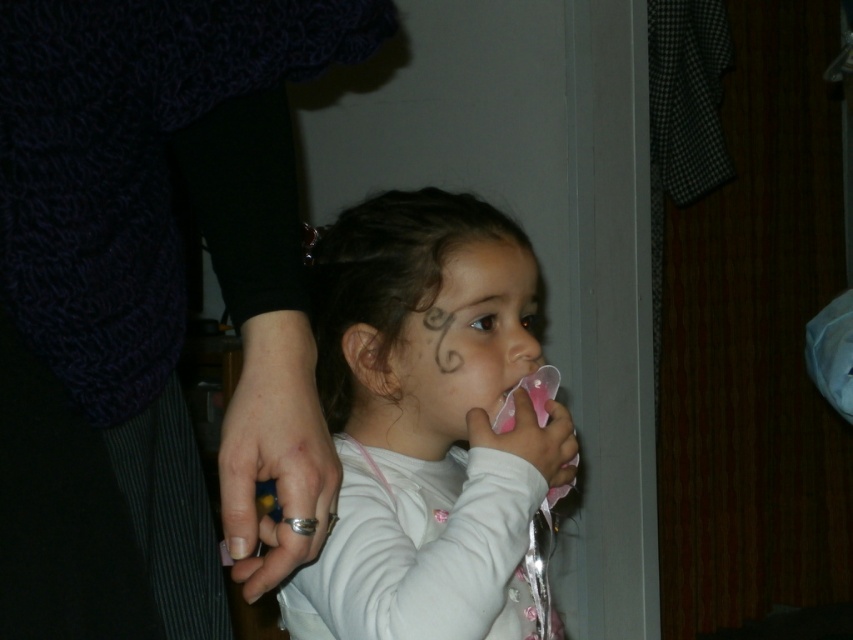
From the picture: Does knitted dark blue sweater at upper left appear under white matte pacifier at center?

No.

In the scene shown: Is knitted dark blue sweater at upper left smaller than white matte pacifier at center?

Correct, knitted dark blue sweater at upper left occupies less space than white matte pacifier at center.

Identify the location of knitted dark blue sweater at upper left. click(152, 305).

Who is positioned more to the right, pink rubber pacifier at center or matte white forehead at center?

matte white forehead at center

How distant is pink rubber pacifier at center from matte white forehead at center?

They are 2.22 inches apart.

Between point (462, 353) and point (490, 260), which one is positioned in front?

Point (462, 353) is in front.

Locate an element on the screen. Image resolution: width=853 pixels, height=640 pixels. pink rubber pacifier at center is located at coordinates (462, 349).

Which is more to the right, white matte pacifier at center or pink rubber pacifier at center?

Positioned to the right is pink rubber pacifier at center.

Which is below, white matte pacifier at center or pink rubber pacifier at center?

white matte pacifier at center is lower down.

Image resolution: width=853 pixels, height=640 pixels. I want to click on white matte pacifier at center, so click(424, 432).